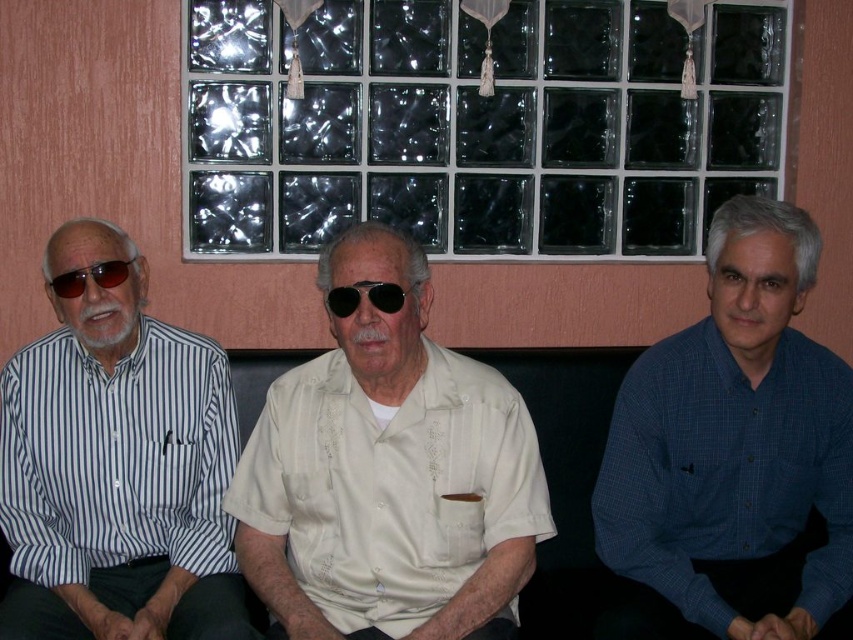
Question: Which is nearer to the matte beige shirt at center?

Choices:
 (A) black reflective sunglasses at center
 (B) white cotton shirt at center
 (C) blue checkered shirt at right
 (D) matte black sunglasses at left

Answer: (A)

Question: In this image, where is white cotton shirt at center located relative to matte black sunglasses at left?

Choices:
 (A) below
 (B) above

Answer: (A)

Question: Which object appears closest to the camera in this image?

Choices:
 (A) matte beige shirt at center
 (B) matte black sunglasses at left
 (C) blue striped shirt at left
 (D) black reflective sunglasses at center

Answer: (A)

Question: Which object is positioned farthest from the white cotton shirt at center?

Choices:
 (A) blue checkered shirt at right
 (B) matte black sunglasses at left
 (C) blue striped shirt at left
 (D) black reflective sunglasses at center

Answer: (B)

Question: Is blue striped shirt at left positioned at the back of white cotton shirt at center?

Choices:
 (A) no
 (B) yes

Answer: (A)

Question: Considering the relative positions of matte beige shirt at center and blue checkered shirt at right in the image provided, where is matte beige shirt at center located with respect to blue checkered shirt at right?

Choices:
 (A) right
 (B) left

Answer: (B)